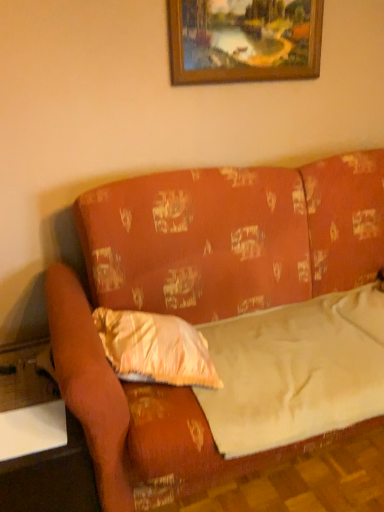
The image size is (384, 512). What are the coordinates of `vacant area situated below white plastic table at lower left, which is counted as the first table, starting from the top (from a real-world perspective)` in the screenshot? It's located at (38, 428).